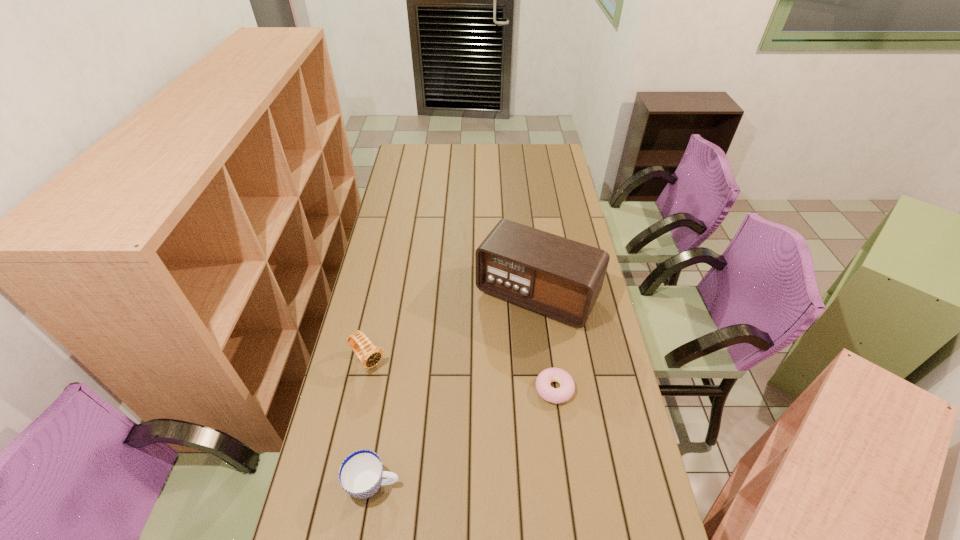
This screenshot has width=960, height=540. Identify the location of cup. (361, 474).

The width and height of the screenshot is (960, 540). I want to click on the nearest object, so click(x=361, y=474).

You are a GUI agent. You are given a task and a screenshot of the screen. Output one action in this format:
    pyautogui.click(x=<x>, y=<y>)
    Task: Click on the shortest object
    This screenshot has height=540, width=960.
    Given the screenshot: What is the action you would take?
    pyautogui.click(x=567, y=386)

Find the location of `watch`. watch is located at coordinates (370, 355).

Identify the location of the farthest object. Image resolution: width=960 pixels, height=540 pixels. (560, 278).

In order to click on radio receiver in this screenshot , I will do `click(560, 278)`.

At what (x,y) coordinates should I click in order to perform the action: click on free space located 0.260m on the side of the cup with the handle. Please return your answer as a coordinate pair (x, y). This screenshot has width=960, height=540. Looking at the image, I should click on (498, 484).

Identify the location of vacant space located on the right of the shortest object. This screenshot has height=540, width=960. (603, 389).

Identify the location of vacant space located on the face of the watch. This screenshot has width=960, height=540. (421, 418).

I want to click on vacant space located on the face of the watch, so click(397, 392).